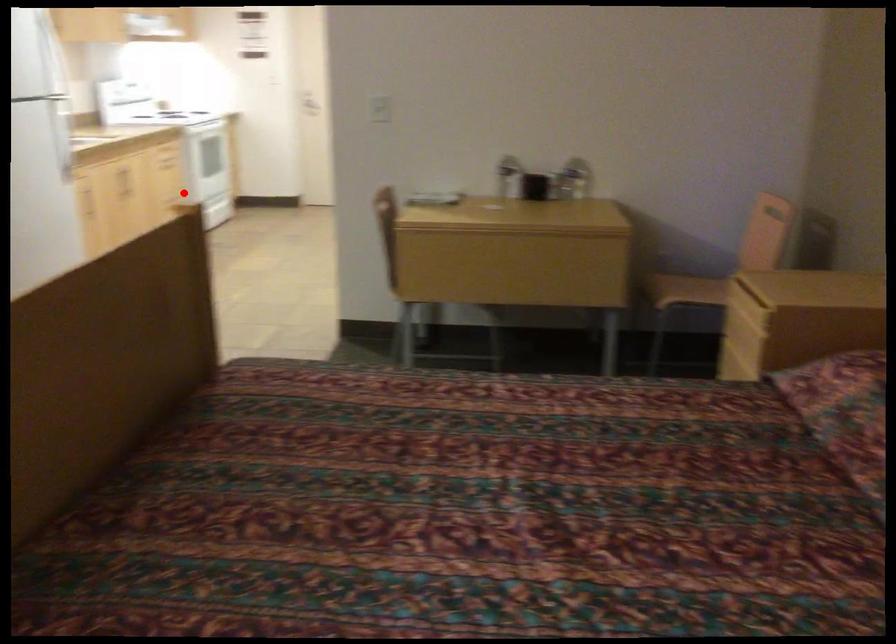
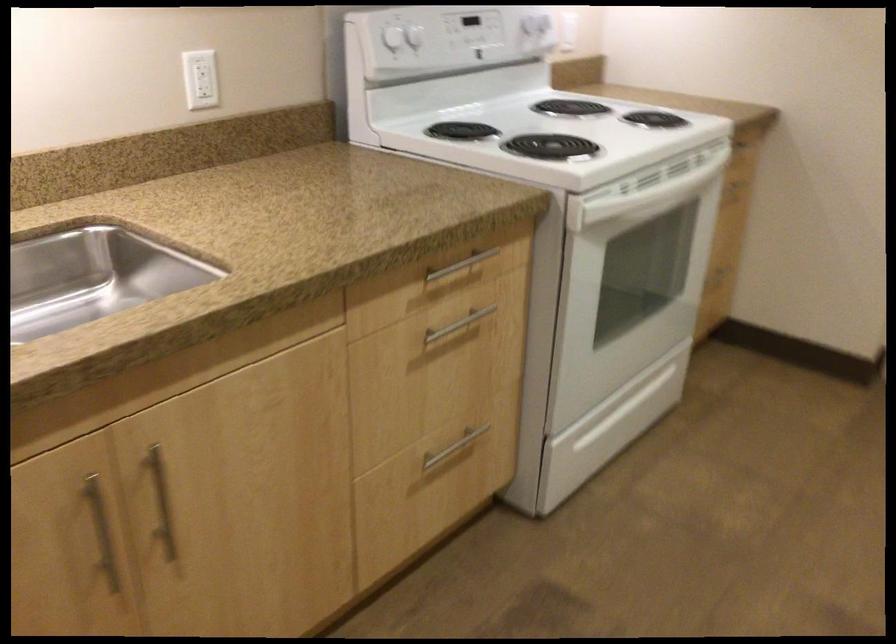
The point at the highlighted location is marked in the first image. Where is the corresponding point in the second image?

(453, 448)